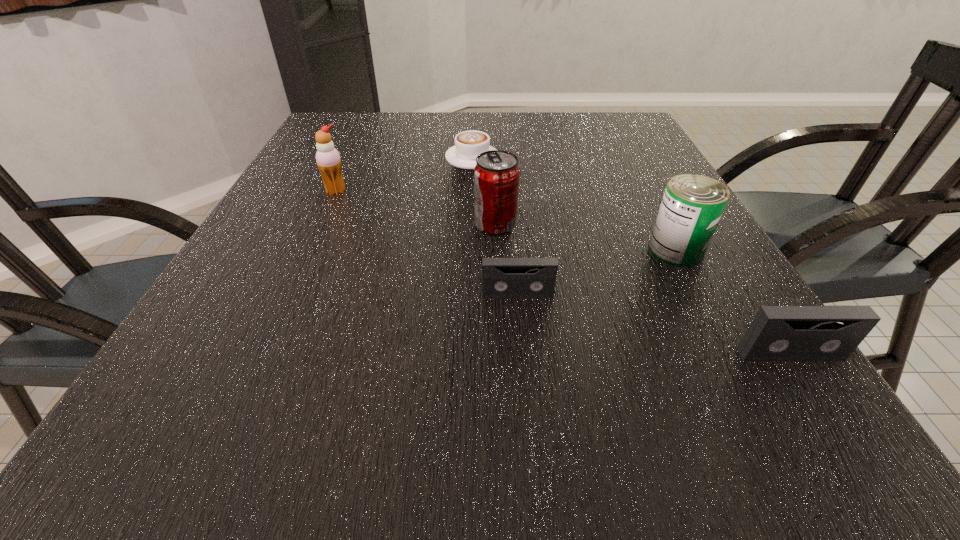
You are a GUI agent. You are given a task and a screenshot of the screen. Output one action in this format:
    pyautogui.click(x=<x>, y=<y>)
    Task: Click on the videotape at the right edge
    This screenshot has width=960, height=540.
    Given the screenshot: What is the action you would take?
    pyautogui.click(x=777, y=333)

This screenshot has width=960, height=540. In order to click on can present at the right edge in this screenshot , I will do `click(692, 205)`.

Find the location of a particular element. The height and width of the screenshot is (540, 960). object that is at the near right corner is located at coordinates (x=777, y=333).

Locate an element on the screen. Image resolution: width=960 pixels, height=540 pixels. vacant space at the far edge of the desktop is located at coordinates (409, 141).

Locate an element on the screen. free space at the near edge of the desktop is located at coordinates (435, 353).

In the image, there is a desktop. Identify the location of vacant space at the left edge. This screenshot has height=540, width=960. (310, 262).

The width and height of the screenshot is (960, 540). In the image, there is a desktop. In order to click on vacant space at the right edge in this screenshot , I will do `click(691, 288)`.

The width and height of the screenshot is (960, 540). Find the location of `vacant space at the far left corner of the desktop`. vacant space at the far left corner of the desktop is located at coordinates (362, 127).

Identify the location of free location at the near left corner of the desktop. tap(253, 334).

Find the location of a particular element. The width and height of the screenshot is (960, 540). free space at the far right corner of the desktop is located at coordinates (588, 116).